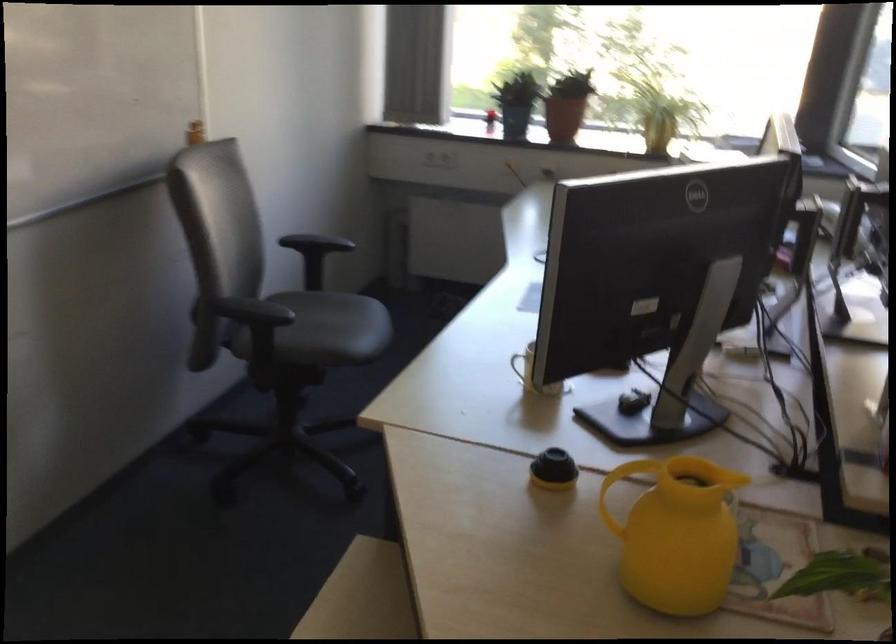
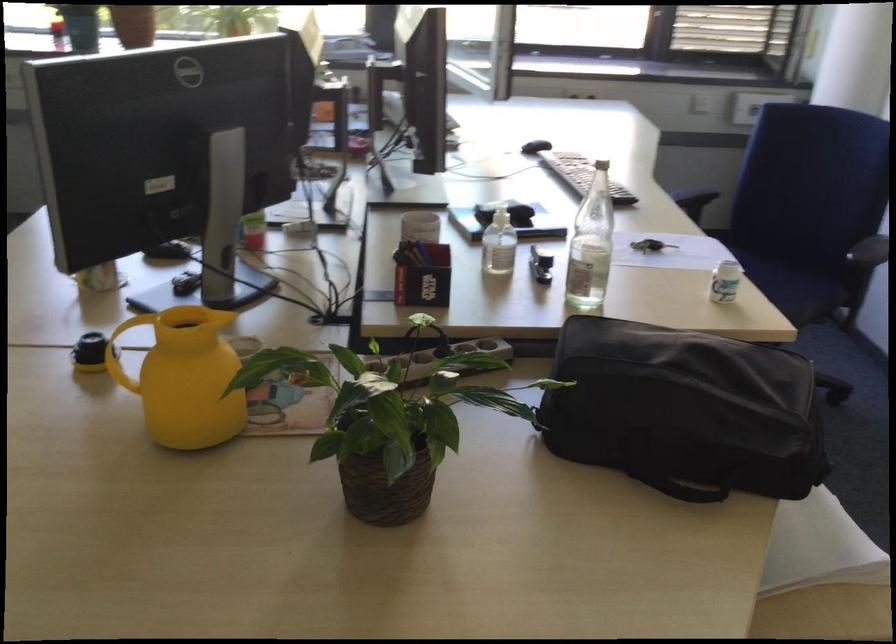
Find the pixel in the second image that matches point (547, 462) in the first image.

(90, 352)